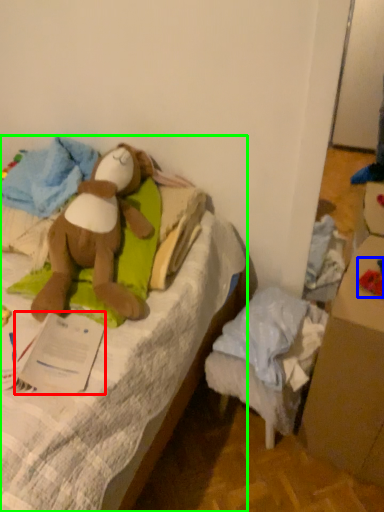
Question: Which is farther away from paper (highlighted by a red box)? toy (highlighted by a blue box) or furniture (highlighted by a green box)?

Choices:
 (A) toy
 (B) furniture

Answer: (A)